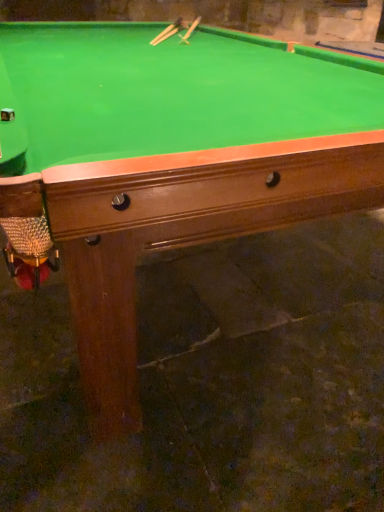
Question: Considering the relative sizes of wooden cue at upper center, arranged as the 2th cue when viewed from the right, and wooden cue at upper center, arranged as the second cue when viewed from the left, in the image provided, is wooden cue at upper center, arranged as the 2th cue when viewed from the right, smaller than wooden cue at upper center, arranged as the second cue when viewed from the left,?

Choices:
 (A) no
 (B) yes

Answer: (B)

Question: Is wooden cue at upper center, arranged as the first cue when viewed from the left, thinner than wooden cue at upper center, arranged as the second cue when viewed from the left?

Choices:
 (A) no
 (B) yes

Answer: (B)

Question: Is wooden cue at upper center, arranged as the 2th cue when viewed from the right, located outside wooden cue at upper center, arranged as the second cue when viewed from the left?

Choices:
 (A) yes
 (B) no

Answer: (A)

Question: Is wooden cue at upper center, arranged as the 2th cue when viewed from the right, at the left side of wooden cue at upper center, which is the 1th cue from right to left?

Choices:
 (A) yes
 (B) no

Answer: (A)

Question: Is wooden cue at upper center, arranged as the first cue when viewed from the left, turned away from wooden cue at upper center, which is the 1th cue from right to left?

Choices:
 (A) yes
 (B) no

Answer: (B)

Question: Is wooden cue at upper center, arranged as the 2th cue when viewed from the right, further to camera compared to wooden cue at upper center, which is the 1th cue from right to left?

Choices:
 (A) no
 (B) yes

Answer: (A)

Question: Would you say wooden cue at upper center, arranged as the second cue when viewed from the left, contains wooden cue at upper center, arranged as the 2th cue when viewed from the right?

Choices:
 (A) yes
 (B) no

Answer: (B)

Question: Is the position of wooden cue at upper center, arranged as the second cue when viewed from the left, less distant than that of wooden cue at upper center, arranged as the first cue when viewed from the left?

Choices:
 (A) no
 (B) yes

Answer: (A)

Question: Considering the relative sizes of wooden cue at upper center, arranged as the second cue when viewed from the left, and wooden cue at upper center, arranged as the first cue when viewed from the left, in the image provided, is wooden cue at upper center, arranged as the second cue when viewed from the left, shorter than wooden cue at upper center, arranged as the first cue when viewed from the left,?

Choices:
 (A) no
 (B) yes

Answer: (A)

Question: Is wooden cue at upper center, arranged as the second cue when viewed from the left, far from wooden cue at upper center, arranged as the 2th cue when viewed from the right?

Choices:
 (A) yes
 (B) no

Answer: (B)

Question: From a real-world perspective, is wooden cue at upper center, which is the 1th cue from right to left, positioned under wooden cue at upper center, arranged as the first cue when viewed from the left, based on gravity?

Choices:
 (A) no
 (B) yes

Answer: (A)

Question: From a real-world perspective, is wooden cue at upper center, which is the 1th cue from right to left, located higher than wooden cue at upper center, arranged as the first cue when viewed from the left?

Choices:
 (A) no
 (B) yes

Answer: (B)

Question: Considering the positions of wooden cue at upper center, arranged as the second cue when viewed from the left, and wooden cue at upper center, arranged as the first cue when viewed from the left, in the image, is wooden cue at upper center, arranged as the second cue when viewed from the left, taller or shorter than wooden cue at upper center, arranged as the first cue when viewed from the left,?

Choices:
 (A) tall
 (B) short

Answer: (A)